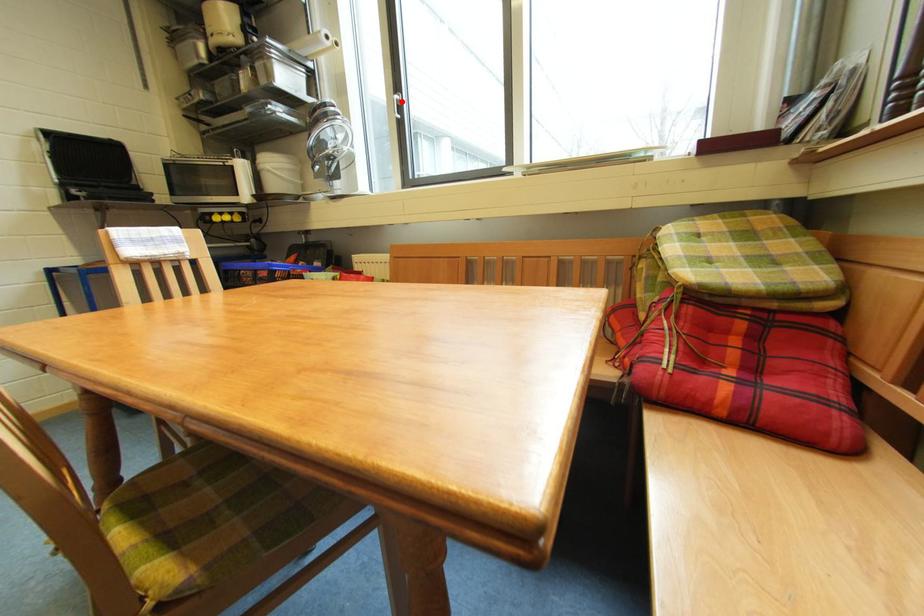
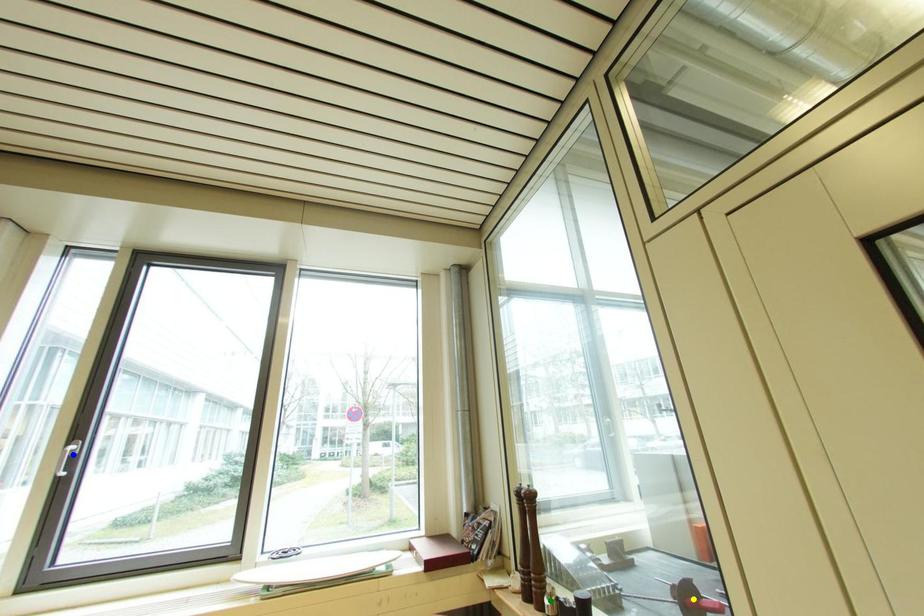
Question: I am providing you with two images of the same scene from different viewpoints. A red point is marked on the first image. You are given multiple points on the second image. Can you choose the point in image 2 that corresponds to the point in image 1?

Choices:
 (A) blue point
 (B) yellow point
 (C) green point

Answer: (A)